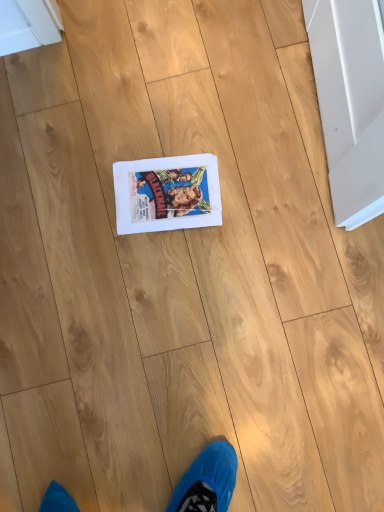
At what (x,y) coordinates should I click in order to perform the action: click on matte paper comic book at center. Please return your answer as a coordinate pair (x, y). Image resolution: width=384 pixels, height=512 pixels. Looking at the image, I should click on (167, 194).

What do you see at coordinates (167, 194) in the screenshot? Image resolution: width=384 pixels, height=512 pixels. I see `matte paper comic book at center` at bounding box center [167, 194].

Where is `matte paper comic book at center`? matte paper comic book at center is located at coordinates (167, 194).